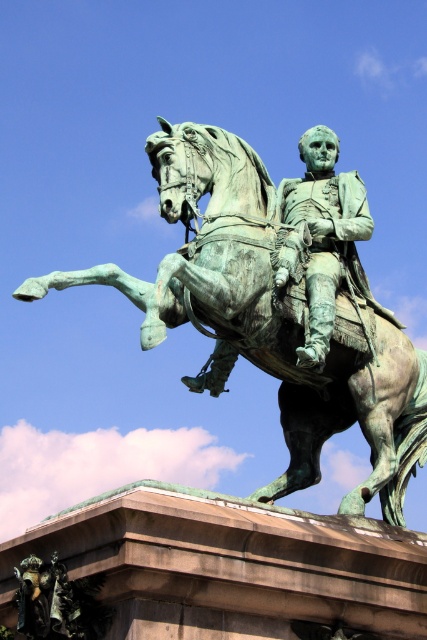
Question: Does green patina horse at center appear over green patina statue at center?

Choices:
 (A) yes
 (B) no

Answer: (A)

Question: Which object is closer to the camera taking this photo?

Choices:
 (A) green patina horse at center
 (B) green patina statue at center

Answer: (A)

Question: Is green patina horse at center above green patina statue at center?

Choices:
 (A) yes
 (B) no

Answer: (A)

Question: Does green patina horse at center appear under green patina statue at center?

Choices:
 (A) yes
 (B) no

Answer: (B)

Question: Which point is farther to the camera?

Choices:
 (A) green patina horse at center
 (B) green patina statue at center

Answer: (B)